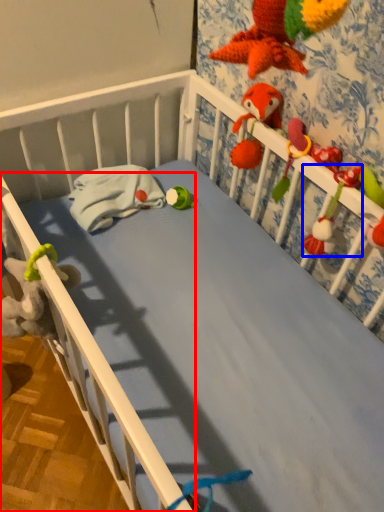
Question: Which point is closer to the camera, rail (highlighted by a red box) or toy (highlighted by a blue box)?

Choices:
 (A) rail
 (B) toy

Answer: (B)